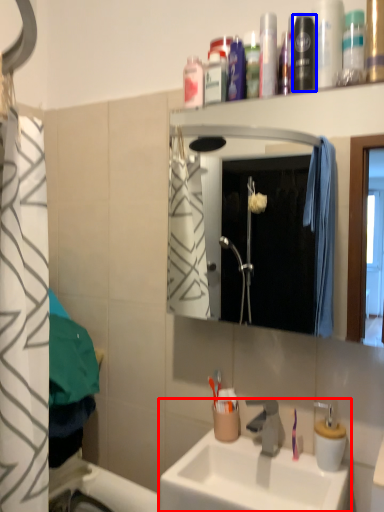
Question: Among these objects, which one is nearest to the camera, sink (highlighted by a red box) or mouthwash (highlighted by a blue box)?

Choices:
 (A) sink
 (B) mouthwash

Answer: (A)